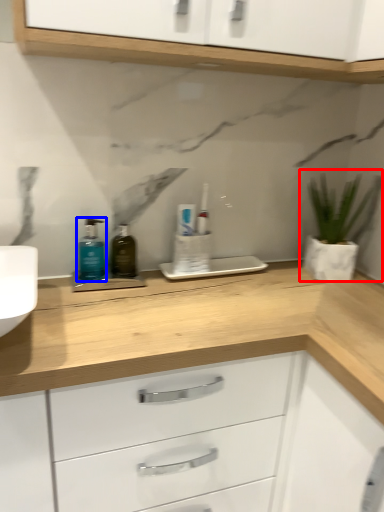
Question: Among these objects, which one is farthest to the camera, houseplant (highlighted by a red box) or toiletry (highlighted by a blue box)?

Choices:
 (A) houseplant
 (B) toiletry

Answer: (A)